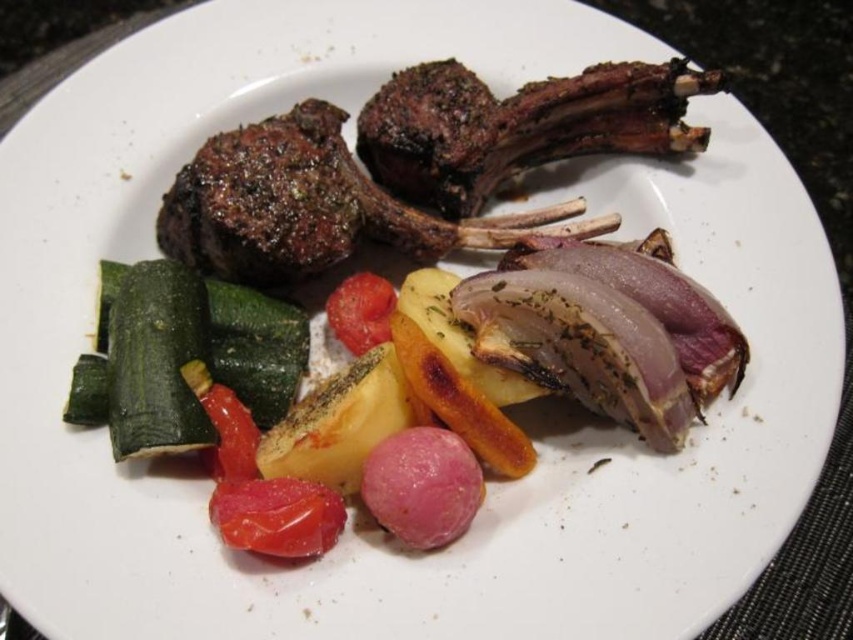
Question: From the image, what is the correct spatial relationship of green zucchini at lower left in relation to glossy red tomato at lower center?

Choices:
 (A) above
 (B) below

Answer: (A)

Question: Is grilled dark brown bone-in rib at upper right above glossy red tomato at lower center?

Choices:
 (A) no
 (B) yes

Answer: (B)

Question: Which of the following is the closest to the observer?

Choices:
 (A) grilled dark brown bone-in rib at upper right
 (B) green zucchini at lower left

Answer: (B)

Question: Does green zucchini at lower left lie in front of glossy red tomato at lower center?

Choices:
 (A) yes
 (B) no

Answer: (B)

Question: Which object is positioned closest to the green zucchini at lower left?

Choices:
 (A) grilled dark brown bone-in rib at upper right
 (B) glossy red tomato at lower center

Answer: (B)

Question: Which of these objects is positioned farthest from the glossy red tomato at lower center?

Choices:
 (A) grilled dark brown bone-in rib at upper right
 (B) green zucchini at lower left

Answer: (A)